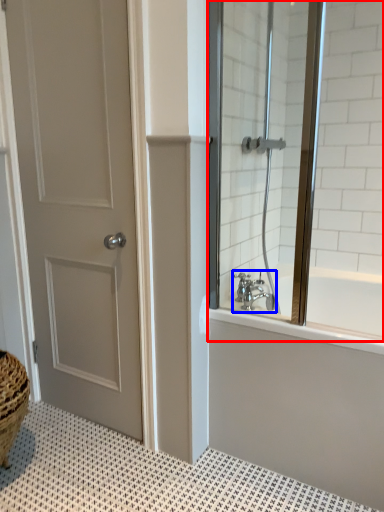
Question: Which object appears closest to the camera in this image, window screen (highlighted by a red box) or tap (highlighted by a blue box)?

Choices:
 (A) window screen
 (B) tap

Answer: (A)